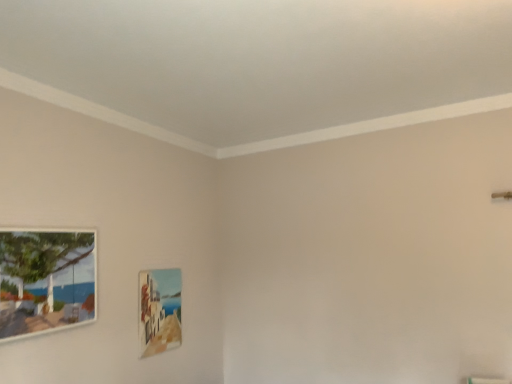
Question: Does matte wooden picture frame at lower center, which is the 2th picture frame in left-to-right order, have a smaller size compared to wooden picture frame at left, the 2th picture frame from the right?

Choices:
 (A) no
 (B) yes

Answer: (B)

Question: Is matte wooden picture frame at lower center, which is the 2th picture frame in left-to-right order, looking in the opposite direction of wooden picture frame at left, the 1th picture frame positioned from the front?

Choices:
 (A) yes
 (B) no

Answer: (B)

Question: Can you confirm if matte wooden picture frame at lower center, the first picture frame positioned from the right, is bigger than wooden picture frame at left, the 1th picture frame positioned from the front?

Choices:
 (A) yes
 (B) no

Answer: (B)

Question: Does matte wooden picture frame at lower center, which is the 2th picture frame in left-to-right order, have a lesser height compared to wooden picture frame at left, the 1th picture frame positioned from the front?

Choices:
 (A) yes
 (B) no

Answer: (B)

Question: From the image's perspective, does matte wooden picture frame at lower center, which is the 2th picture frame in left-to-right order, appear higher than wooden picture frame at left, the first picture frame when ordered from left to right?

Choices:
 (A) no
 (B) yes

Answer: (A)

Question: Is matte wooden picture frame at lower center, which is the 2th picture frame in left-to-right order, outside wooden picture frame at left, the 1th picture frame positioned from the front?

Choices:
 (A) yes
 (B) no

Answer: (A)

Question: Does wooden picture frame at left, acting as the second picture frame starting from the back, come in front of matte wooden picture frame at lower center, which is the 2th picture frame in left-to-right order?

Choices:
 (A) no
 (B) yes

Answer: (B)

Question: Is wooden picture frame at left, the first picture frame when ordered from left to right, oriented towards matte wooden picture frame at lower center, the first picture frame positioned from the right?

Choices:
 (A) no
 (B) yes

Answer: (A)

Question: From the image's perspective, is wooden picture frame at left, acting as the second picture frame starting from the back, under matte wooden picture frame at lower center, the first picture frame from the back?

Choices:
 (A) no
 (B) yes

Answer: (A)

Question: Can you confirm if wooden picture frame at left, the 2th picture frame from the right, is positioned to the left of matte wooden picture frame at lower center, the first picture frame from the back?

Choices:
 (A) yes
 (B) no

Answer: (A)

Question: Does wooden picture frame at left, the 1th picture frame positioned from the front, appear on the right side of matte wooden picture frame at lower center, which is the 2th picture frame in left-to-right order?

Choices:
 (A) no
 (B) yes

Answer: (A)

Question: Is wooden picture frame at left, the 2th picture frame from the right, wider than matte wooden picture frame at lower center, the first picture frame positioned from the right?

Choices:
 (A) no
 (B) yes

Answer: (B)

Question: Is wooden picture frame at left, the first picture frame when ordered from left to right, to the left or to the right of matte wooden picture frame at lower center, arranged as the second picture frame when viewed from the front, in the image?

Choices:
 (A) left
 (B) right

Answer: (A)